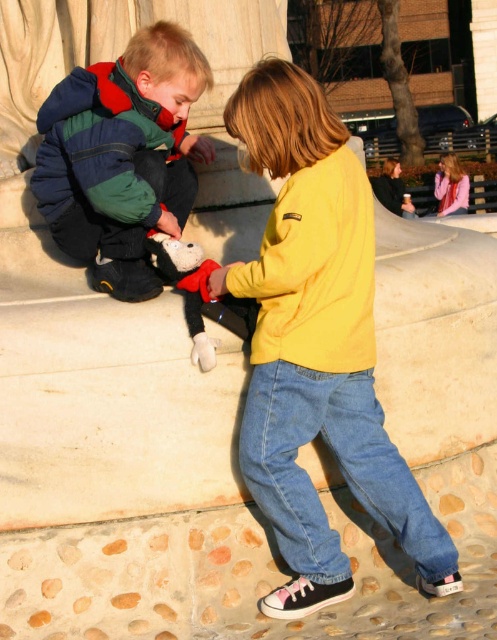
Question: Is yellow fleece jacket at center closer to the viewer compared to matte green jacket at lower left?

Choices:
 (A) yes
 (B) no

Answer: (A)

Question: Which of the following is the closest to the observer?

Choices:
 (A) denim jeans at lower center
 (B) yellow quilted sweatshirt at center
 (C) yellow fleece jacket at center

Answer: (B)

Question: Does yellow fleece jacket at center come behind denim jeans at lower center?

Choices:
 (A) no
 (B) yes

Answer: (A)

Question: Which of the following is the farthest from the observer?

Choices:
 (A) (258, 296)
 (B) (297, 342)
 (C) (100, 234)

Answer: (C)

Question: Which of the following is the closest to the observer?

Choices:
 (A) matte yellow jacket at center
 (B) denim at left
 (C) matte green jacket at lower left
 (D) yellow quilted sweatshirt at center

Answer: (D)

Question: Does matte green jacket at lower left have a lesser width compared to denim jeans at lower center?

Choices:
 (A) no
 (B) yes

Answer: (B)